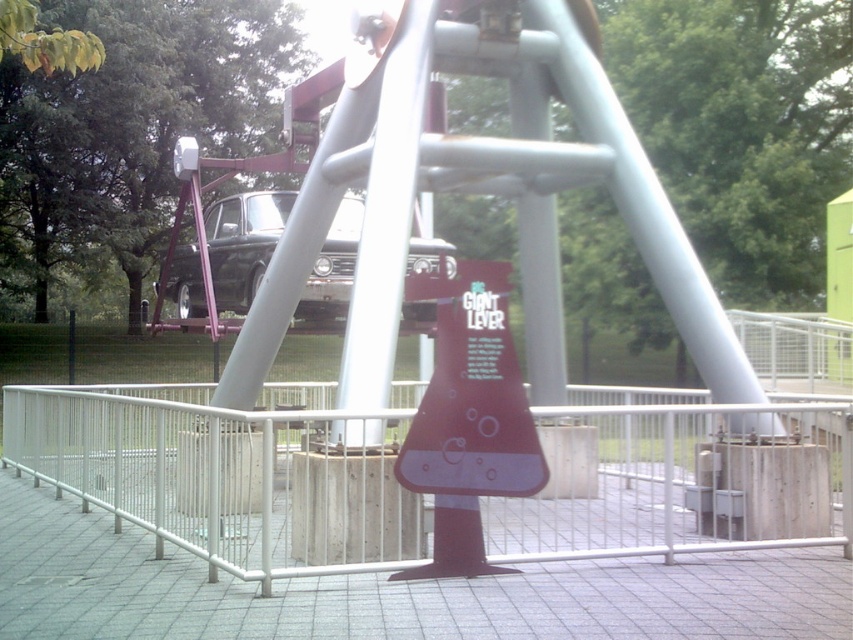
Between white metal fence at center and matte purple sign at center, which one is positioned lower?

white metal fence at center

Who is shorter, white metal fence at center or matte purple sign at center?

With less height is white metal fence at center.

Who is more forward, [675,444] or [505,326]?

Point [505,326] is more forward.

The height and width of the screenshot is (640, 853). I want to click on white metal fence at center, so click(229, 472).

Is white metal fence at center shorter than shiny black car at center?

Yes, white metal fence at center is shorter than shiny black car at center.

Can you confirm if white metal fence at center is smaller than shiny black car at center?

Correct, white metal fence at center occupies less space than shiny black car at center.

The height and width of the screenshot is (640, 853). Describe the element at coordinates (229, 472) in the screenshot. I see `white metal fence at center` at that location.

This screenshot has height=640, width=853. Identify the location of white metal fence at center. (229, 472).

Does matte purple sign at center appear under shiny black car at center?

Indeed, matte purple sign at center is positioned under shiny black car at center.

What do you see at coordinates (471, 394) in the screenshot? Image resolution: width=853 pixels, height=640 pixels. I see `matte purple sign at center` at bounding box center [471, 394].

The width and height of the screenshot is (853, 640). Identify the location of matte purple sign at center. pos(471,394).